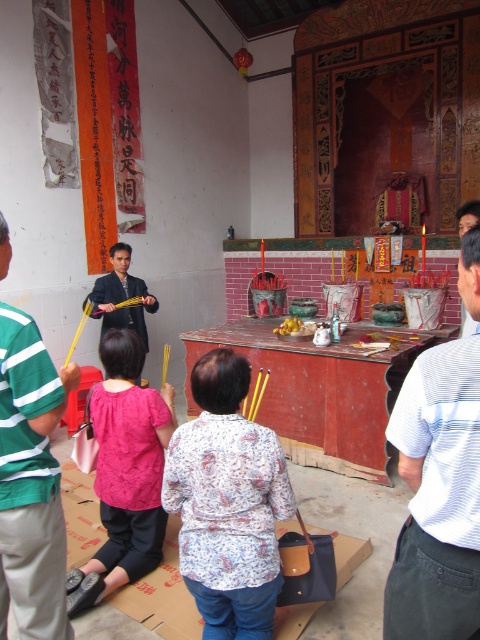
You are standing in the temple and want to hand an offering to the person wearing the white striped shirt at right. Based on their position, where should you walk to reach them?

The white striped shirt at right is located at point (437, 497), so you should walk towards the right side of the scene to reach them.

You are an observer standing in the middle of the temple. You see the white striped shirt at right and the matte pink blouse at lower left. Which person is positioned higher in the scene?

The white striped shirt at right is positioned higher than the matte pink blouse at lower left in the scene.